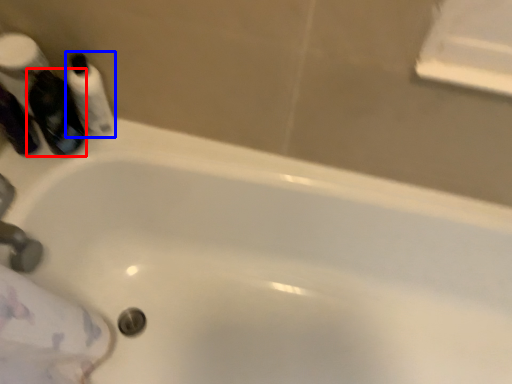
Question: Which object is further to the camera taking this photo, mouthwash (highlighted by a red box) or mouthwash (highlighted by a blue box)?

Choices:
 (A) mouthwash
 (B) mouthwash

Answer: (B)